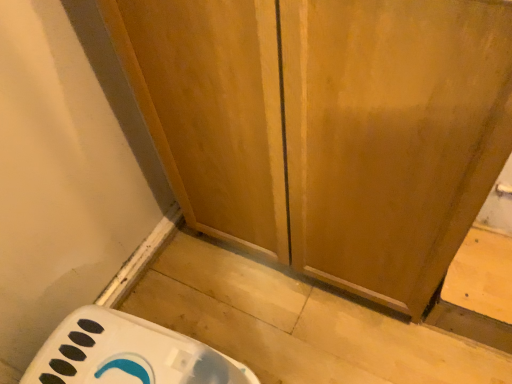
What do you see at coordinates (127, 354) in the screenshot? I see `white plastic cabinet at lower left` at bounding box center [127, 354].

Locate an element on the screen. white plastic cabinet at lower left is located at coordinates (127, 354).

Where is `white plastic cabinet at lower left`? This screenshot has height=384, width=512. white plastic cabinet at lower left is located at coordinates (127, 354).